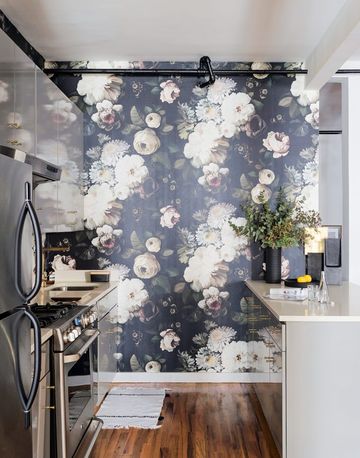
Locate an element on the screen. The height and width of the screenshot is (458, 360). fridge compartment is located at coordinates (17, 390).